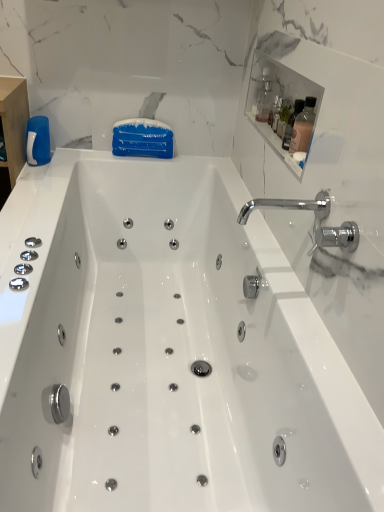
The image size is (384, 512). Find the location of `free space in front of blue glossy bottle at left`. free space in front of blue glossy bottle at left is located at coordinates click(39, 173).